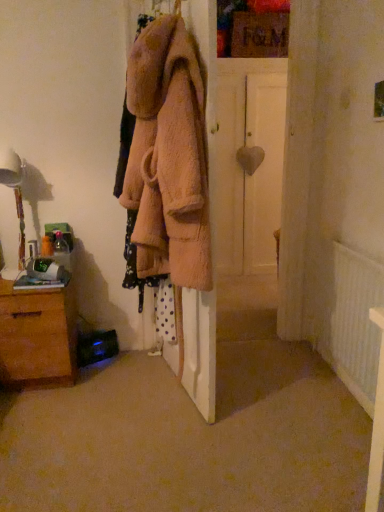
Question: Can you confirm if white glossy table lamp at left is smaller than white textured radiator at lower right?

Choices:
 (A) no
 (B) yes

Answer: (B)

Question: Could you tell me if white glossy table lamp at left is turned towards white textured radiator at lower right?

Choices:
 (A) no
 (B) yes

Answer: (A)

Question: Can you confirm if white glossy table lamp at left is shorter than white textured radiator at lower right?

Choices:
 (A) no
 (B) yes

Answer: (B)

Question: Is white glossy table lamp at left to the left of white textured radiator at lower right from the viewer's perspective?

Choices:
 (A) yes
 (B) no

Answer: (A)

Question: From a real-world perspective, is white glossy table lamp at left on white textured radiator at lower right?

Choices:
 (A) yes
 (B) no

Answer: (A)

Question: Would you say white glossy table lamp at left is a long distance from white textured radiator at lower right?

Choices:
 (A) no
 (B) yes

Answer: (B)

Question: From a real-world perspective, is brown wooden chest of drawers at lower left under white textured radiator at lower right?

Choices:
 (A) yes
 (B) no

Answer: (A)

Question: Is brown wooden chest of drawers at lower left not near white textured radiator at lower right?

Choices:
 (A) no
 (B) yes

Answer: (B)

Question: Is brown wooden chest of drawers at lower left bigger than white textured radiator at lower right?

Choices:
 (A) yes
 (B) no

Answer: (A)

Question: Does brown wooden chest of drawers at lower left have a lesser width compared to white textured radiator at lower right?

Choices:
 (A) yes
 (B) no

Answer: (B)

Question: Could you tell me if brown wooden chest of drawers at lower left is facing white textured radiator at lower right?

Choices:
 (A) no
 (B) yes

Answer: (A)

Question: Can we say brown wooden chest of drawers at lower left lies outside white textured radiator at lower right?

Choices:
 (A) yes
 (B) no

Answer: (A)

Question: Considering the relative sizes of white matte door at center and white textured radiator at lower right in the image provided, is white matte door at center shorter than white textured radiator at lower right?

Choices:
 (A) no
 (B) yes

Answer: (A)